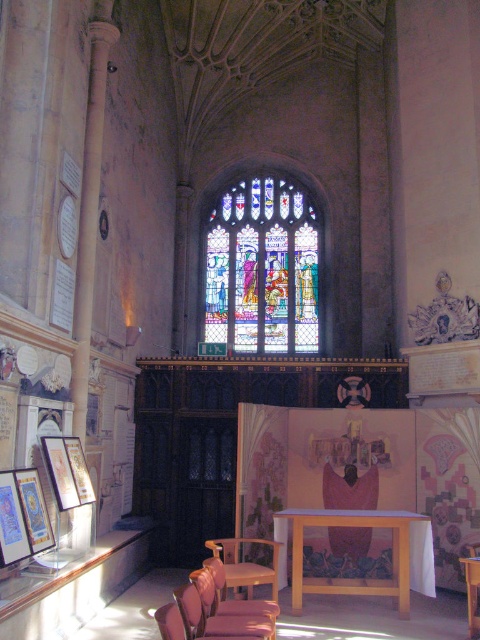
Question: Estimate the real-world distances between objects in this image. Which object is closer to the leather cushioned chair at lower center?

Choices:
 (A) wooden picture frame at lower left
 (B) stained glass window at center
 (C) wooden polished chair at lower center
 (D) matte wooden picture frame at lower left

Answer: (C)

Question: In this image, where is matte wooden picture frame at lower left located relative to leather cushioned chair at lower center?

Choices:
 (A) below
 (B) above

Answer: (B)

Question: Which of the following is the closest to the observer?

Choices:
 (A) wooden picture frame at lower left
 (B) matte gold picture frame at lower left

Answer: (B)

Question: Is wooden chair at lower center to the left of matte wooden picture frame at lower left from the viewer's perspective?

Choices:
 (A) yes
 (B) no

Answer: (B)

Question: Which of these objects is positioned closest to the matte wooden picture frame at lower left?

Choices:
 (A) leather cushioned chair at lower center
 (B) stained glass window at center
 (C) wooden table at lower right
 (D) light wood table at center

Answer: (A)

Question: Does wooden chair at lower center appear under matte gold picture frame at lower left?

Choices:
 (A) yes
 (B) no

Answer: (A)